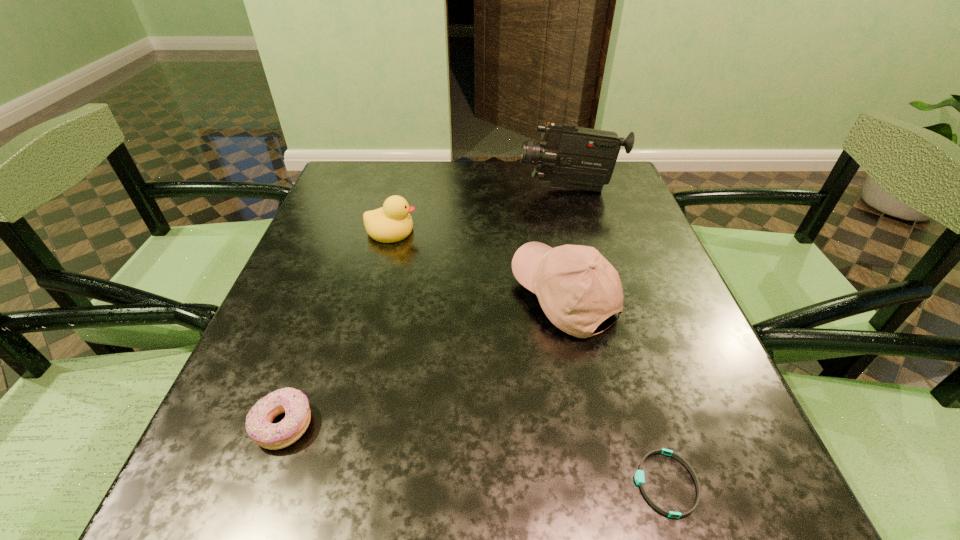
The image size is (960, 540). Find the location of `vacant point at the left edge`. vacant point at the left edge is located at coordinates (320, 439).

In the image, there is a desktop. Where is `vacant space at the right edge`? The width and height of the screenshot is (960, 540). vacant space at the right edge is located at coordinates (685, 384).

The height and width of the screenshot is (540, 960). In the image, there is a desktop. Find the location of `blank space at the far left corner`. blank space at the far left corner is located at coordinates (377, 195).

At what (x,y) coordinates should I click in order to perform the action: click on vacant space at the far right corner of the desktop. Please return your answer as a coordinate pair (x, y). Image resolution: width=960 pixels, height=540 pixels. Looking at the image, I should click on (610, 183).

The width and height of the screenshot is (960, 540). I want to click on vacant point located between the duckling and the third nearest object, so click(477, 264).

Locate an element on the screen. The height and width of the screenshot is (540, 960). free space between the fourth nearest object and the farthest object is located at coordinates (480, 210).

Image resolution: width=960 pixels, height=540 pixels. I want to click on empty space that is in between the camcorder and the third shortest object, so click(480, 210).

What are the coordinates of `free space between the second shortest object and the farthest object` in the screenshot? It's located at (426, 307).

This screenshot has height=540, width=960. Identify the location of blank region between the fourth tallest object and the farthest object. click(x=426, y=307).

Identify the location of vacant space in between the fourth nearest object and the camcorder. The width and height of the screenshot is (960, 540). (480, 210).